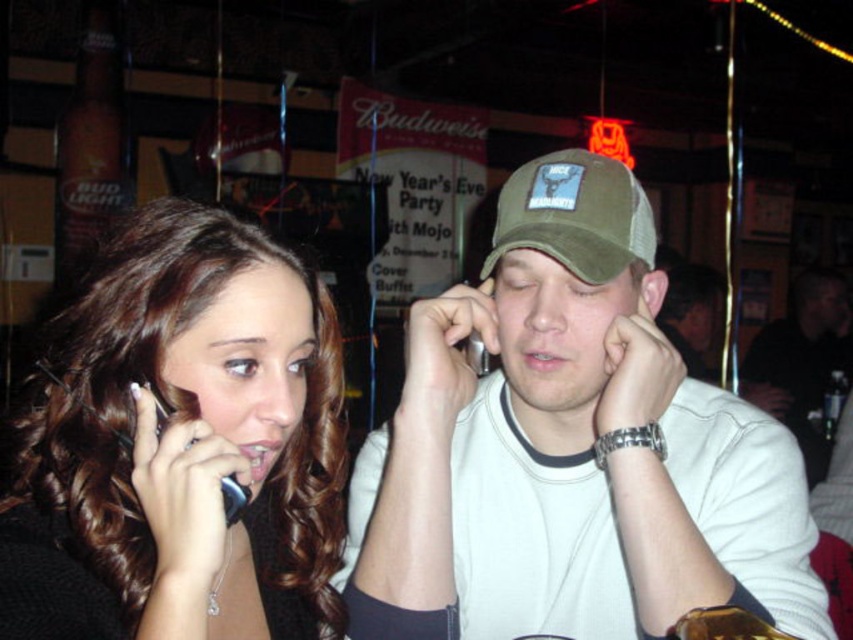
Question: Which object is the closest to the black plastic phone at left?

Choices:
 (A) shiny black phone at left
 (B) olive green mesh baseball cap at center

Answer: (A)

Question: Among these points, which one is farthest from the camera?

Choices:
 (A) (509, 227)
 (B) (56, 465)
 (C) (131, 384)

Answer: (A)

Question: Does olive green mesh baseball cap at center have a smaller size compared to black plastic phone at left?

Choices:
 (A) no
 (B) yes

Answer: (A)

Question: Which of the following is the closest to the observer?

Choices:
 (A) khaki fabric cap at center
 (B) olive green mesh baseball cap at center

Answer: (A)

Question: In this image, where is shiny black phone at left located relative to black plastic phone at left?

Choices:
 (A) below
 (B) above

Answer: (A)

Question: Can you confirm if khaki fabric cap at center is bigger than black plastic phone at left?

Choices:
 (A) yes
 (B) no

Answer: (A)